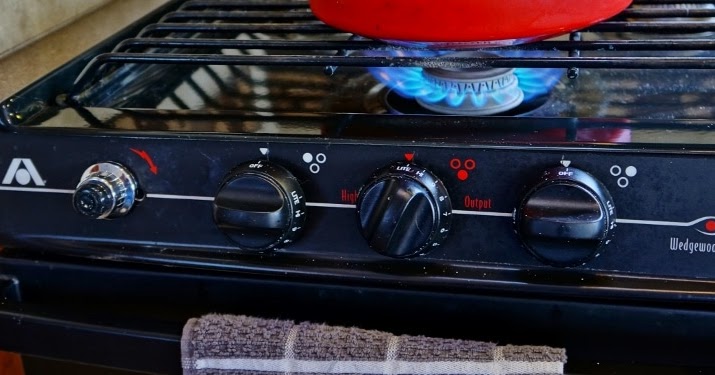
Locate an element on the screen. Image resolution: width=715 pixels, height=375 pixels. gas burner is located at coordinates tap(473, 92).